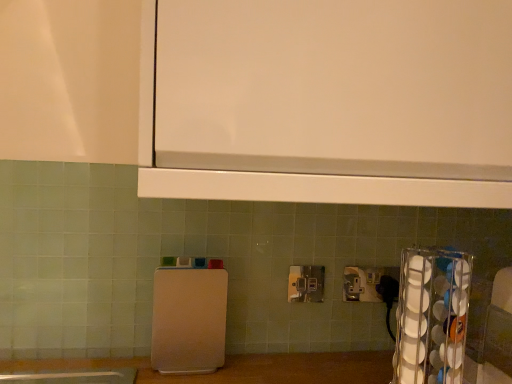
Question: From the image's perspective, is white plastic cutting board at center, marked as the second appliance in a front-to-back arrangement, positioned above or below clear plastic cup holder at right, positioned as the second appliance in left-to-right order?

Choices:
 (A) below
 (B) above

Answer: (B)

Question: Is white plastic cutting board at center, which is the first appliance from back to front, inside or outside of clear plastic cup holder at right, arranged as the 1th appliance when viewed from the right?

Choices:
 (A) outside
 (B) inside

Answer: (A)

Question: Estimate the real-world distances between objects in this image. Which object is closer to the clear plastic cup holder at right, acting as the second appliance starting from the back?

Choices:
 (A) metallic silver power plugs and sockets at center
 (B) white plastic cutting board at center, the 2th appliance viewed from the right

Answer: (A)

Question: Which object is the closest to the white plastic cutting board at center, the 2th appliance viewed from the right?

Choices:
 (A) clear plastic cup holder at right, positioned as the second appliance in left-to-right order
 (B) metallic silver power plugs and sockets at center

Answer: (B)